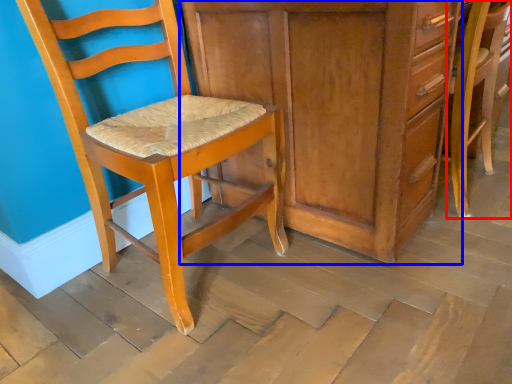
Question: Which point is closer to the camera, chair (highlighted by a red box) or cabinetry (highlighted by a blue box)?

Choices:
 (A) chair
 (B) cabinetry

Answer: (B)